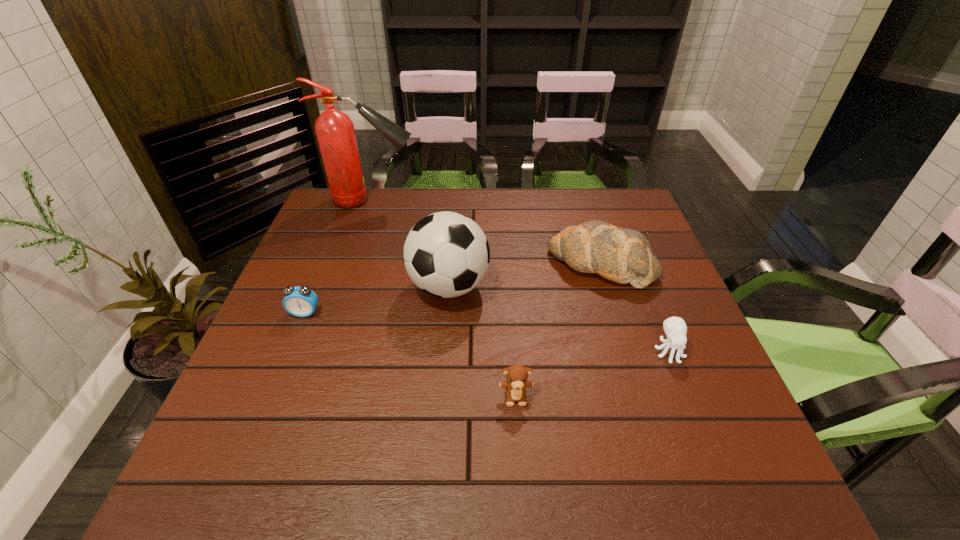
Locate an element on the screen. This screenshot has height=540, width=960. the farthest object is located at coordinates (335, 133).

Locate an element on the screen. the tallest object is located at coordinates (335, 133).

Find the location of a particular element. This screenshot has width=960, height=540. soccer ball is located at coordinates (446, 254).

This screenshot has height=540, width=960. I want to click on the second tallest object, so click(x=446, y=254).

Locate an element on the screen. the fourth shortest object is located at coordinates (622, 255).

You are a GUI agent. You are given a task and a screenshot of the screen. Output one action in this format:
    pyautogui.click(x=<x>, y=<y>)
    Task: Click on the octopus
    This screenshot has width=960, height=540.
    Given the screenshot: What is the action you would take?
    pyautogui.click(x=675, y=328)

I want to click on alarm clock, so click(301, 301).

Where is `the fourth object from left to right`? The width and height of the screenshot is (960, 540). the fourth object from left to right is located at coordinates (516, 384).

Where is `teddy bear`? The image size is (960, 540). teddy bear is located at coordinates point(516,384).

The image size is (960, 540). In order to click on free space located at the nozzle end of the farthest object in this screenshot , I will do `click(538, 200)`.